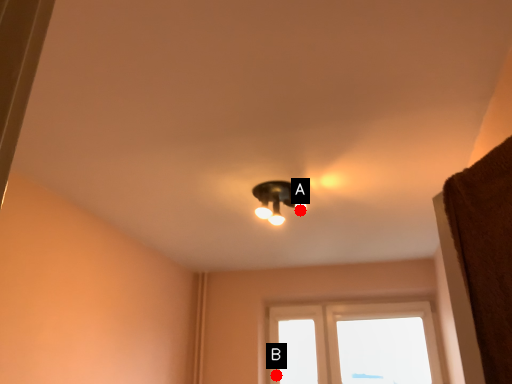
Question: Two points are circled on the image, labeled by A and B beside each circle. Which point is farther from the camera taking this photo?

Choices:
 (A) A is further
 (B) B is further

Answer: (B)